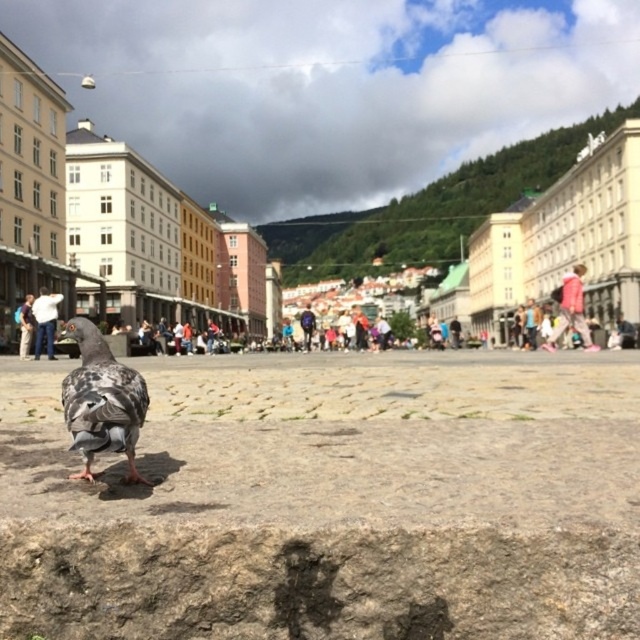
Question: Is gray matte pigeon at lower left below white cotton shirt at center?

Choices:
 (A) yes
 (B) no

Answer: (A)

Question: Among these points, which one is nearest to the camera?

Choices:
 (A) (97, 372)
 (B) (36, 305)

Answer: (A)

Question: Does gray matte pigeon at lower left have a greater width compared to white cotton shirt at center?

Choices:
 (A) yes
 (B) no

Answer: (B)

Question: Which object is closer to the camera taking this photo?

Choices:
 (A) dark blue jeans at center
 (B) pink fabric at upper right

Answer: (A)

Question: Which point is closer to the camera taking this photo?

Choices:
 (A) (561, 321)
 (B) (38, 349)
 (C) (19, 310)

Answer: (B)

Question: In this image, where is pink fabric at upper right located relative to dark blue jeans at center?

Choices:
 (A) right
 (B) left

Answer: (A)